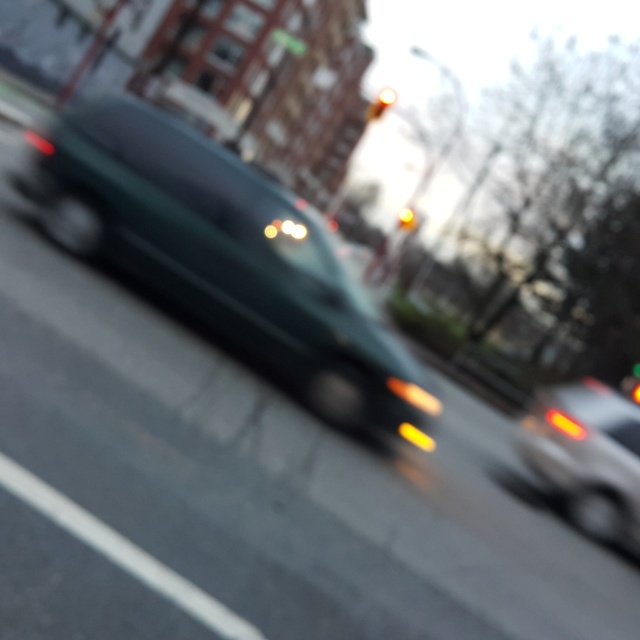
Can you confirm if matte silver car at right is thinner than yellow glass traffic light at center?

In fact, matte silver car at right might be wider than yellow glass traffic light at center.

Does matte silver car at right appear on the right side of yellow glass traffic light at center?

Yes, matte silver car at right is to the right of yellow glass traffic light at center.

Who is more distant from viewer, (595, 483) or (404, 225)?

Positioned behind is point (404, 225).

You are a GUI agent. You are given a task and a screenshot of the screen. Output one action in this format:
    pyautogui.click(x=<x>, y=<y>)
    Task: Click on the matte silver car at right
    The image size is (640, 640).
    Given the screenshot: What is the action you would take?
    pyautogui.click(x=586, y=456)

Is the position of dark green matte van at center more distant than that of yellow glass traffic light at upper center?

No, dark green matte van at center is closer to the viewer.

Is point (230, 241) positioned behind point (385, 104)?

No, (230, 241) is closer to viewer.

Does point (177, 198) come behind point (371, 120)?

No, (177, 198) is closer to viewer.

The width and height of the screenshot is (640, 640). I want to click on dark green matte van at center, so click(224, 253).

How far apart are dark green matte van at center and yellow glass traffic light at center?

The distance of dark green matte van at center from yellow glass traffic light at center is 95.98 feet.

At what (x,y) coordinates should I click in order to perform the action: click on dark green matte van at center. Please return your answer as a coordinate pair (x, y). Looking at the image, I should click on (224, 253).

This screenshot has width=640, height=640. In order to click on dark green matte van at center in this screenshot , I will do `click(224, 253)`.

The image size is (640, 640). I want to click on dark green matte van at center, so click(224, 253).